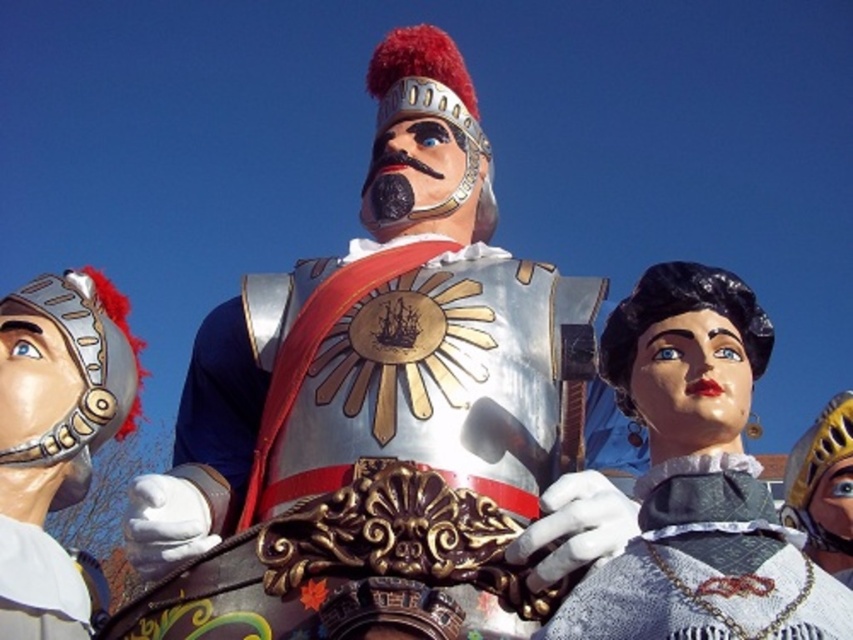
You are an artist trying to paint the scene. You need to locate the point at coordinates [61,387]. According to the scene description, where exactly is this point located?

The point at coordinates [61,387] is located on the metallic helmet at left.

What is located at the point with coordinates [697,481] in the image?

The point at coordinates [697,481] indicates a smooth black wig at center.